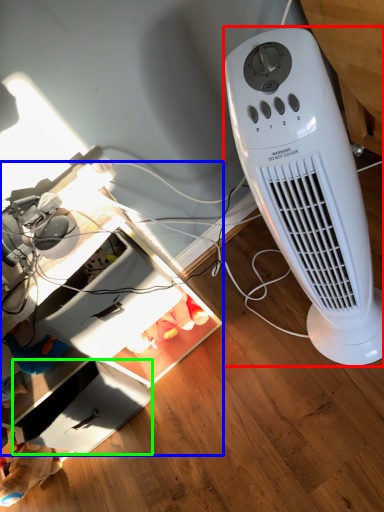
Question: Which is nearer to the home appliance (highlighted by a red box)? computer desk (highlighted by a blue box) or drawer (highlighted by a green box).

Choices:
 (A) computer desk
 (B) drawer

Answer: (A)